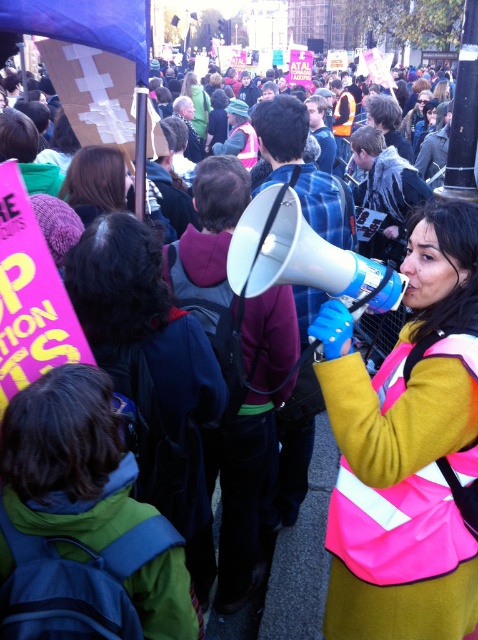
Looking at this image, you are a photographer at the protest scene. You want to capture a photo where both the neon pink reflective vest at center and the blue plastic megaphone at center are clearly visible. Based on their positions, which object should you focus on first to ensure both are in frame?

The neon pink reflective vest at center is below the blue plastic megaphone at center, so you should focus on the blue plastic megaphone at center first to ensure both are in frame.

You are a photographer trying to capture the protest leader. You see the neon pink reflective vest at center and the blue plastic megaphone at center. Which object is closer to you?

The neon pink reflective vest at center is closer to you because it is in front of the blue plastic megaphone at center.

You are a drone operator trying to locate a specific point in the protest scene. The point is at coordinates (406, 449). What object is located at this point?

The point at coordinates (406, 449) corresponds to the neon pink reflective vest at center.